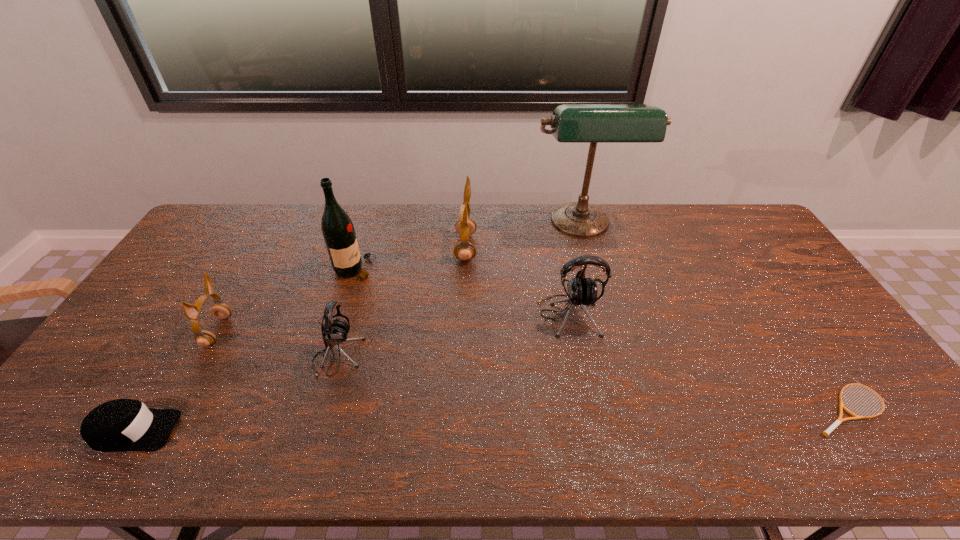
Identify the location of object located in the near left corner section of the desktop. This screenshot has width=960, height=540. (119, 425).

Where is `object that is at the near right corner`? object that is at the near right corner is located at coordinates (826, 433).

Image resolution: width=960 pixels, height=540 pixels. I want to click on vacant space at the far edge, so click(689, 241).

In the image, there is a desktop. Where is `vacant space at the left edge`? The height and width of the screenshot is (540, 960). vacant space at the left edge is located at coordinates (96, 387).

Where is `vacant space at the right edge of the desktop`? The width and height of the screenshot is (960, 540). vacant space at the right edge of the desktop is located at coordinates (837, 340).

This screenshot has height=540, width=960. What are the coordinates of `free location at the far right corner` in the screenshot? It's located at (721, 211).

Locate an element on the screen. This screenshot has height=540, width=960. free space between the rightmost earphone and the fifth object from left to right is located at coordinates (517, 281).

Find the location of a particular element. The height and width of the screenshot is (540, 960). empty space between the green wine bottle and the smaller black earphone is located at coordinates (347, 313).

Where is `vacant space in between the tennis racket and the wine bottle`? vacant space in between the tennis racket and the wine bottle is located at coordinates (602, 338).

This screenshot has height=540, width=960. Identify the location of unoccupied area between the wine bottle and the nearer brown earphone. (286, 300).